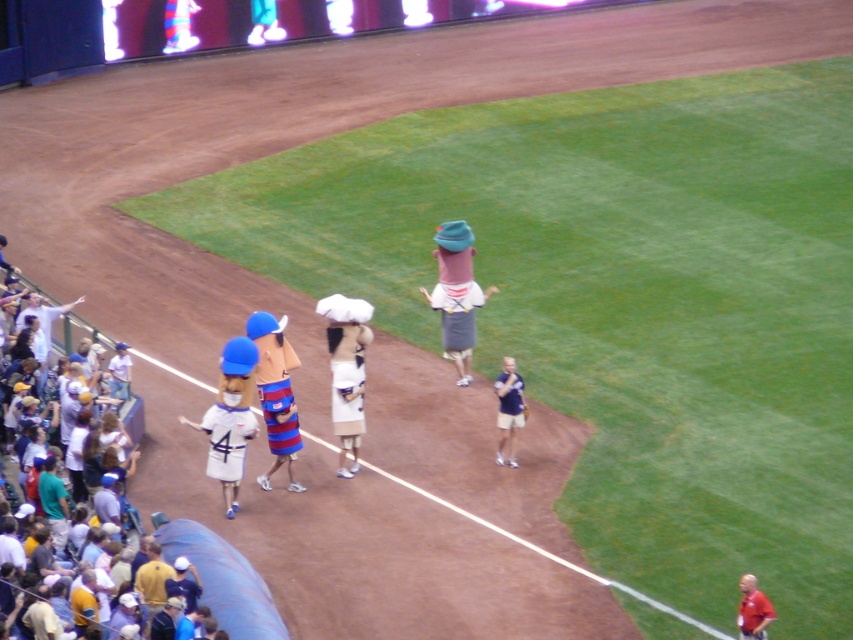
Question: Is striped fabric mascot at center positioned behind red matte baseball uniform at lower right?

Choices:
 (A) yes
 (B) no

Answer: (A)

Question: Is white cotton shirt at left wider than striped fabric mascot at center?

Choices:
 (A) yes
 (B) no

Answer: (A)

Question: Which point appears farthest from the camera in this image?

Choices:
 (A) [358, 328]
 (B) [503, 444]
 (C) [122, 396]

Answer: (C)

Question: Which is farther from the striped fabric mascot at center?

Choices:
 (A) white matte baseball at center
 (B) red matte baseball uniform at lower right

Answer: (B)

Question: Can you confirm if white cotton shirt at left is bigger than white matte baseball at center?

Choices:
 (A) yes
 (B) no

Answer: (A)

Question: Which point is farther to the camera?

Choices:
 (A) (741, 608)
 (B) (524, 412)

Answer: (B)